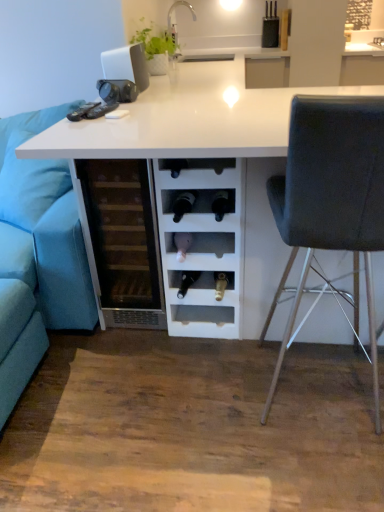
Identify the location of free location to the left of dark grey fabric chair at right. tap(210, 402).